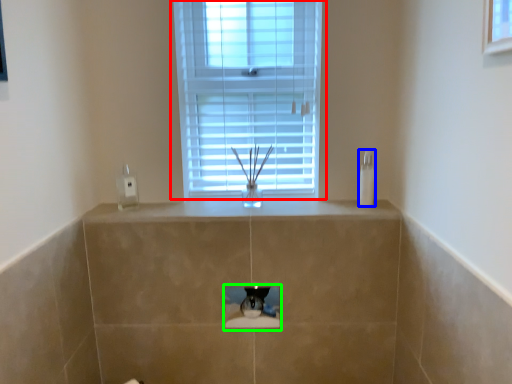
Question: Which object is the closest to the window (highlighted by a red box)? Choose among these: soap dispenser (highlighted by a blue box) or hole (highlighted by a green box).

Choices:
 (A) soap dispenser
 (B) hole

Answer: (A)